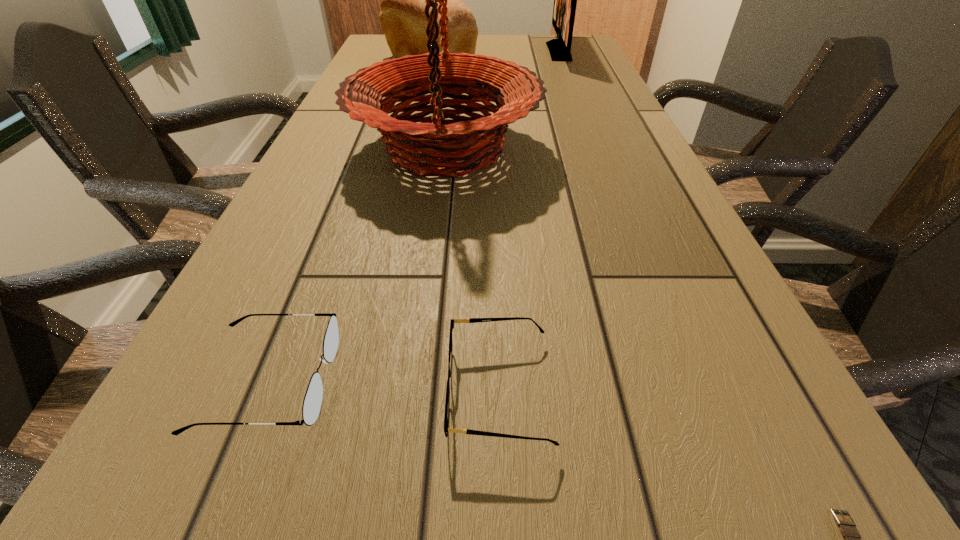
Where is `the tallest object`? The height and width of the screenshot is (540, 960). the tallest object is located at coordinates (413, 146).

Locate an element on the screen. This screenshot has width=960, height=540. basket is located at coordinates (413, 146).

You are a GUI agent. You are given a task and a screenshot of the screen. Output one action in this format:
    pyautogui.click(x=<x>, y=<y>)
    Task: Click on the monitor
    The image size is (960, 540).
    Given the screenshot: What is the action you would take?
    pyautogui.click(x=565, y=0)

Where is `the fifth object from left to right`? Image resolution: width=960 pixels, height=540 pixels. the fifth object from left to right is located at coordinates (565, 0).

Locate an element on the screen. the fourth shortest object is located at coordinates (402, 18).

The image size is (960, 540). In order to click on the left spectacles in this screenshot , I will do `click(312, 403)`.

The width and height of the screenshot is (960, 540). Identify the location of the right spectacles. (469, 320).

Image resolution: width=960 pixels, height=540 pixels. I want to click on vacant position located 0.320m on the back of the tallest object, so click(455, 66).

Locate an element on the screen. Image resolution: width=960 pixels, height=540 pixels. free space located on the front-facing side of the fifth shortest object is located at coordinates (462, 52).

Identify the location of blank area located 0.290m on the front-facing side of the fifth shortest object. This screenshot has width=960, height=540. (462, 52).